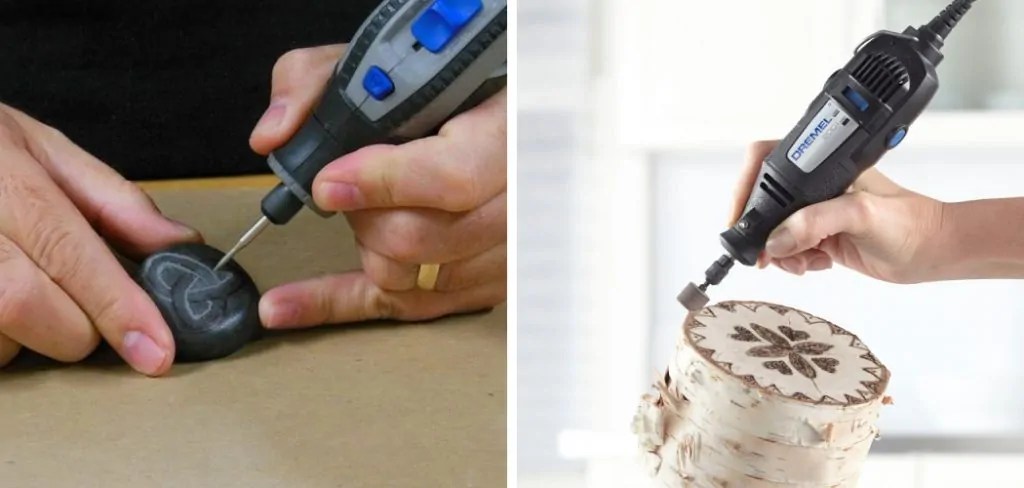
Where is `table`? This screenshot has height=488, width=1024. table is located at coordinates (462, 445).